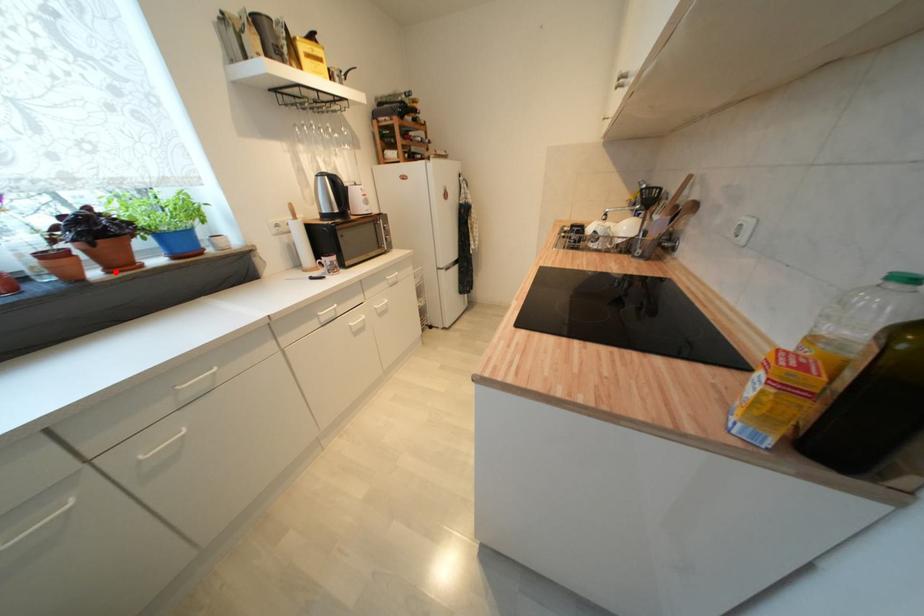
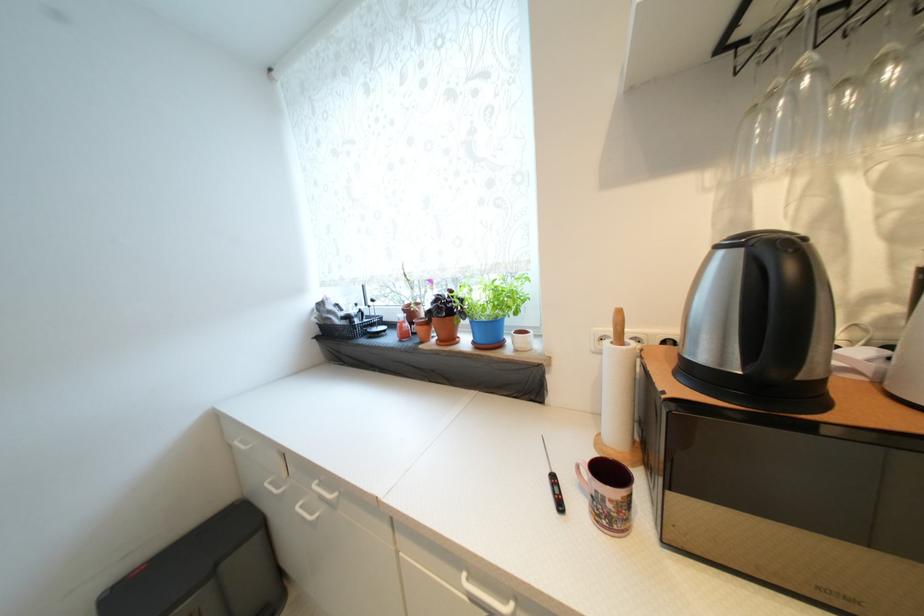
The point at the highlighted location is marked in the first image. Where is the corresponding point in the second image?

(445, 342)